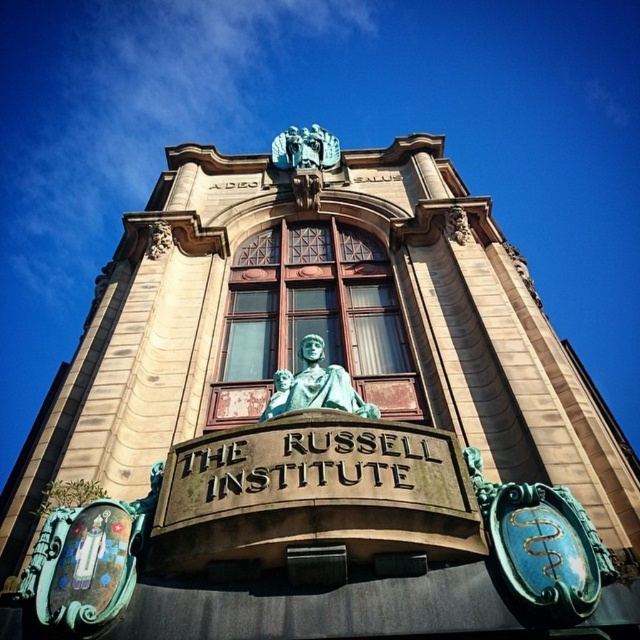
Question: Which point is closer to the camera taking this photo?

Choices:
 (A) 330,387
 (B) 298,148

Answer: (A)

Question: Which point appears farthest from the camera in this image?

Choices:
 (A) (300, 156)
 (B) (307, 392)

Answer: (A)

Question: Does green patina statue at center have a larger size compared to bronze statue at upper center?

Choices:
 (A) no
 (B) yes

Answer: (A)

Question: Observing the image, what is the correct spatial positioning of green patina statue at center in reference to bronze statue at upper center?

Choices:
 (A) above
 (B) below

Answer: (B)

Question: Does green patina statue at center come in front of bronze statue at upper center?

Choices:
 (A) no
 (B) yes

Answer: (B)